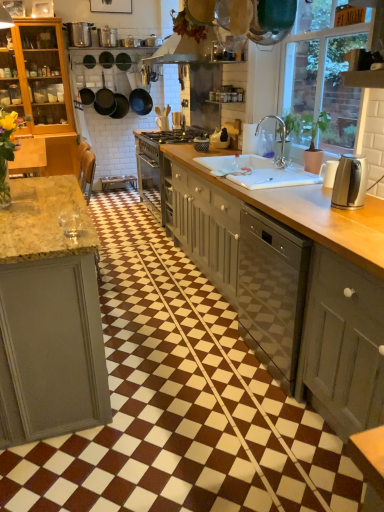
Where is `free spot to the left of wooden at center`? free spot to the left of wooden at center is located at coordinates (155, 269).